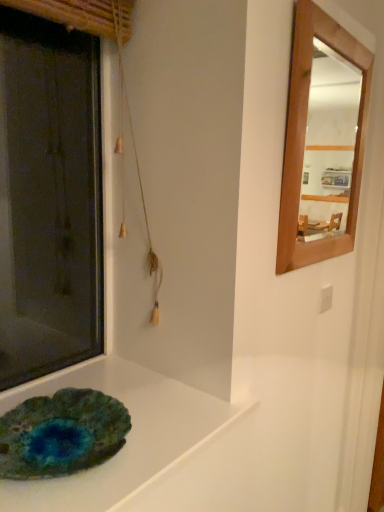
Where is `free space above matte stone slab at lower left (from a real-world perspective)`? free space above matte stone slab at lower left (from a real-world perspective) is located at coordinates (130, 423).